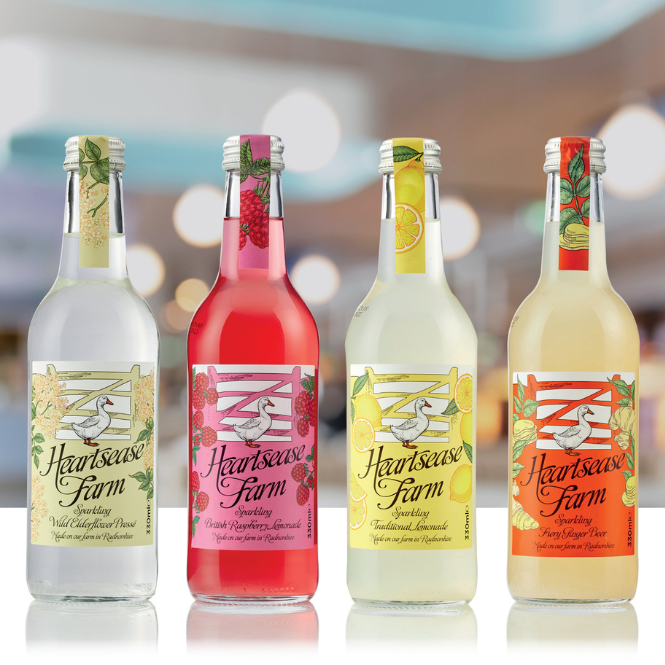
Identify the location of bottle with red liquid inside. (237, 316).